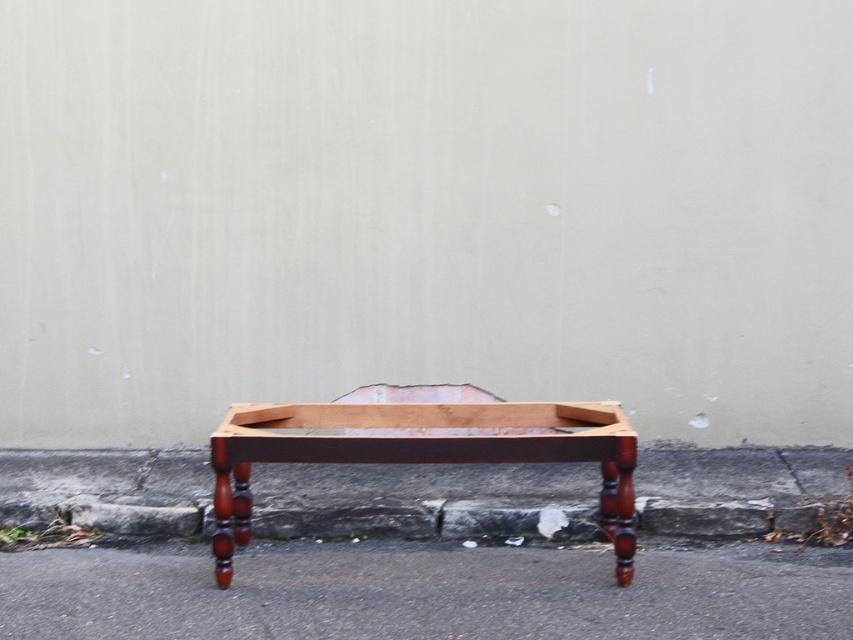
Question: Does mahogany wood table at center have a smaller size compared to gray concrete curb at lower center?

Choices:
 (A) no
 (B) yes

Answer: (A)

Question: Among these objects, which one is nearest to the camera?

Choices:
 (A) gray concrete curb at lower center
 (B) mahogany wood table at center
 (C) smooth asphalt at lower center

Answer: (C)

Question: Which point is closer to the camera?

Choices:
 (A) mahogany wood table at center
 (B) smooth asphalt at lower center

Answer: (B)

Question: Can you confirm if smooth asphalt at lower center is smaller than mahogany wood table at center?

Choices:
 (A) yes
 (B) no

Answer: (A)

Question: Estimate the real-world distances between objects in this image. Which object is closer to the gray concrete curb at lower center?

Choices:
 (A) mahogany wood table at center
 (B) smooth asphalt at lower center

Answer: (A)

Question: Is smooth asphalt at lower center to the right of gray concrete curb at lower center from the viewer's perspective?

Choices:
 (A) yes
 (B) no

Answer: (B)